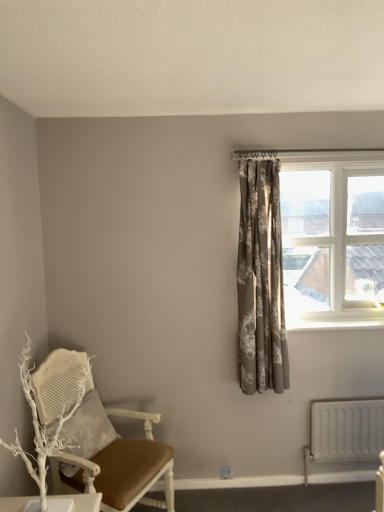
Question: From a real-world perspective, is white matte radiator at lower right under silvery-grey floral curtain at upper right?

Choices:
 (A) yes
 (B) no

Answer: (A)

Question: Is white matte radiator at lower right not within silvery-grey floral curtain at upper right?

Choices:
 (A) yes
 (B) no

Answer: (A)

Question: From the image's perspective, is white matte radiator at lower right under silvery-grey floral curtain at upper right?

Choices:
 (A) yes
 (B) no

Answer: (A)

Question: From a real-world perspective, is white matte radiator at lower right positioned over silvery-grey floral curtain at upper right based on gravity?

Choices:
 (A) no
 (B) yes

Answer: (A)

Question: Does white matte radiator at lower right have a greater width compared to silvery-grey floral curtain at upper right?

Choices:
 (A) yes
 (B) no

Answer: (B)

Question: From a real-world perspective, is white painted wood at upper right physically located above or below white matte radiator at lower right?

Choices:
 (A) above
 (B) below

Answer: (A)

Question: Is point (332, 324) positioned closer to the camera than point (337, 409)?

Choices:
 (A) farther
 (B) closer

Answer: (A)

Question: Considering the positions of white painted wood at upper right and white matte radiator at lower right in the image, is white painted wood at upper right wider or thinner than white matte radiator at lower right?

Choices:
 (A) thin
 (B) wide

Answer: (B)

Question: Considering the positions of white painted wood at upper right and white matte radiator at lower right in the image, is white painted wood at upper right bigger or smaller than white matte radiator at lower right?

Choices:
 (A) small
 (B) big

Answer: (A)

Question: Is point (153, 453) positioned closer to the camera than point (243, 300)?

Choices:
 (A) farther
 (B) closer

Answer: (B)

Question: From the image's perspective, is white painted wood chair at left located above or below silvery-grey floral curtain at upper right?

Choices:
 (A) below
 (B) above

Answer: (A)

Question: Considering the positions of white painted wood chair at left and silvery-grey floral curtain at upper right in the image, is white painted wood chair at left taller or shorter than silvery-grey floral curtain at upper right?

Choices:
 (A) tall
 (B) short

Answer: (B)

Question: In terms of width, does white painted wood chair at left look wider or thinner when compared to silvery-grey floral curtain at upper right?

Choices:
 (A) wide
 (B) thin

Answer: (A)

Question: In the image, is white painted wood at upper right positioned in front of or behind silvery-grey floral curtain at upper right?

Choices:
 (A) behind
 (B) front

Answer: (A)

Question: Based on their sizes in the image, would you say white painted wood at upper right is bigger or smaller than silvery-grey floral curtain at upper right?

Choices:
 (A) big
 (B) small

Answer: (B)